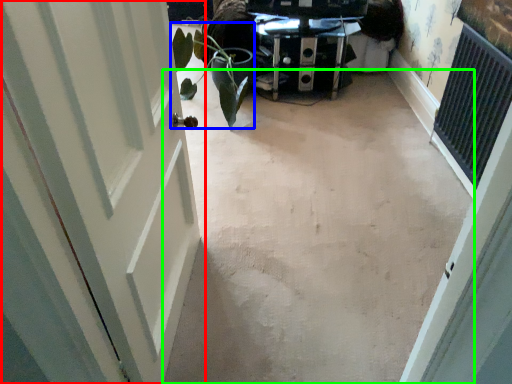
Question: Based on their relative distances, which object is farther from door (highlighted by a red box)? Choose from plant (highlighted by a blue box) and concrete (highlighted by a green box).

Choices:
 (A) plant
 (B) concrete

Answer: (A)